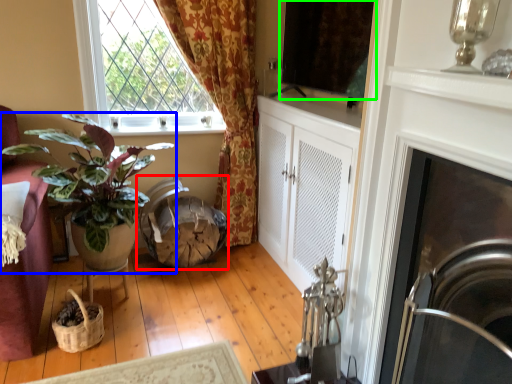
Question: Estimate the real-world distances between objects in this image. Which object is closer to swivel chair (highlighted by a red box), houseplant (highlighted by a blue box) or window screen (highlighted by a green box)?

Choices:
 (A) houseplant
 (B) window screen

Answer: (A)